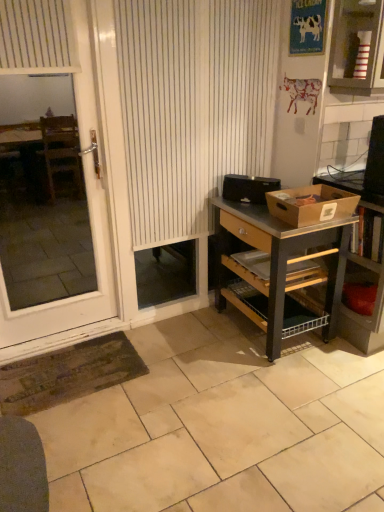
Where is `vacant space situated above beige tile at lower center (from a real-world perspective)`? The height and width of the screenshot is (512, 384). vacant space situated above beige tile at lower center (from a real-world perspective) is located at coordinates (211, 409).